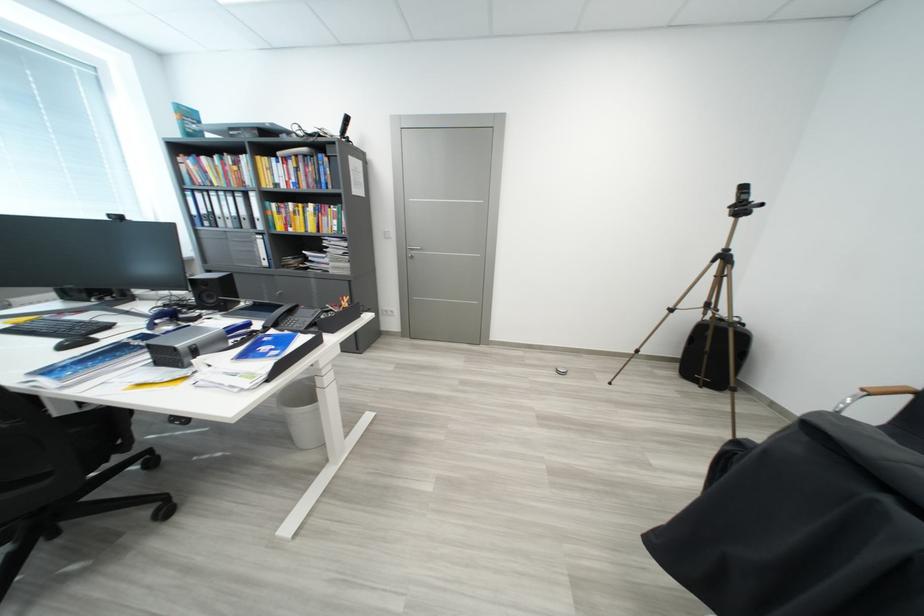
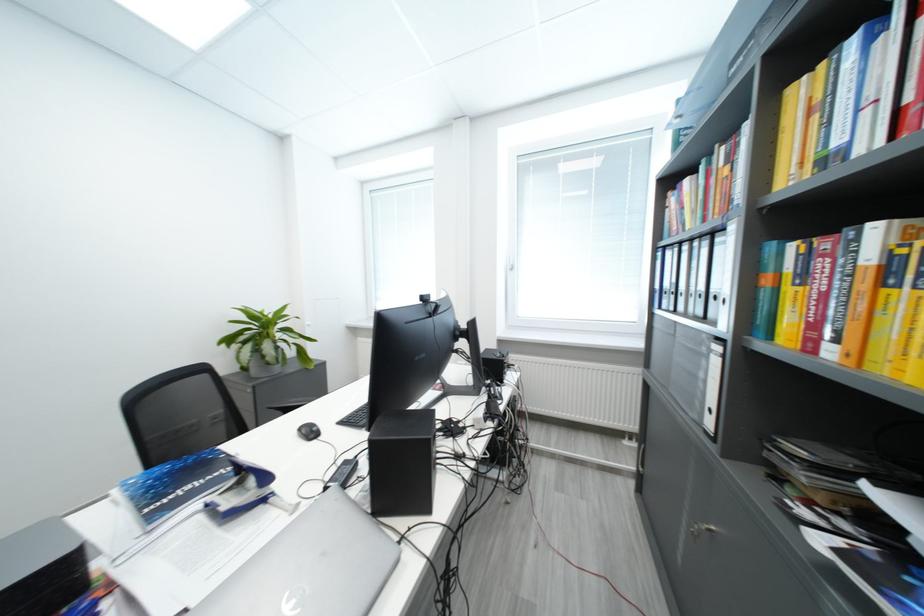
The point at (x=283, y=161) is marked in the first image. Where is the corresponding point in the second image?

(861, 44)